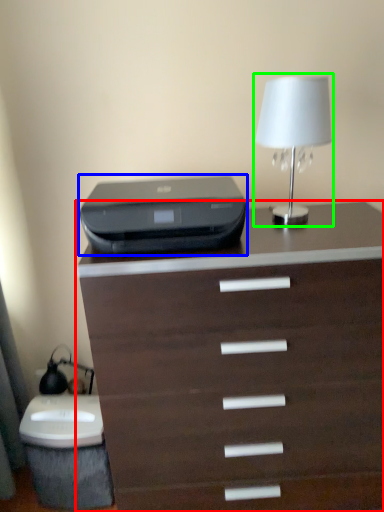
Question: Estimate the real-world distances between objects in this image. Which object is farther from chest of drawers (highlighted by a red box), printer (highlighted by a blue box) or table lamp (highlighted by a green box)?

Choices:
 (A) printer
 (B) table lamp

Answer: (B)